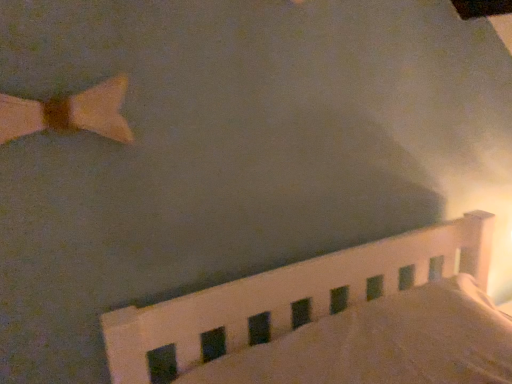
What are the coordinates of `white matte bed at lower right` in the screenshot? It's located at (289, 297).

The image size is (512, 384). What do you see at coordinates (289, 297) in the screenshot?
I see `white matte bed at lower right` at bounding box center [289, 297].

Identify the location of white matte bed at lower right. The height and width of the screenshot is (384, 512). (289, 297).